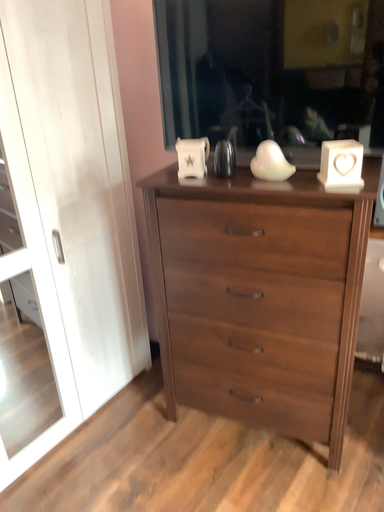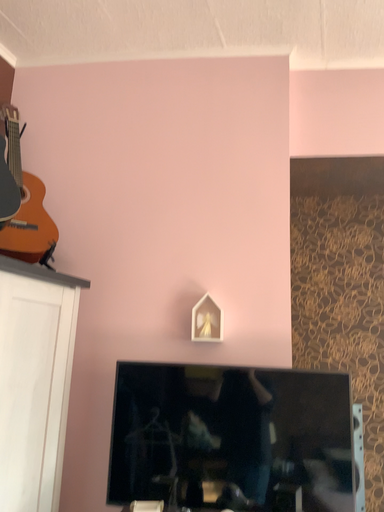
Question: How did the camera likely rotate when shooting the video?

Choices:
 (A) rotated downward
 (B) rotated upward

Answer: (B)